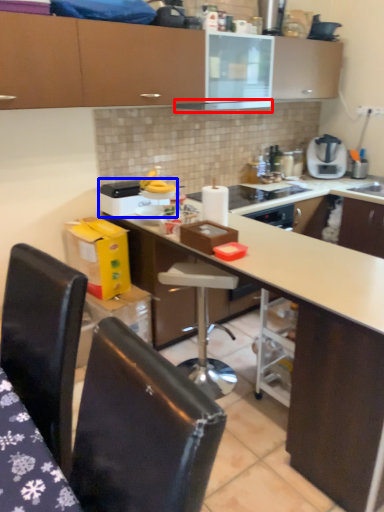
Question: Which object appears farthest to the camera in this image, exhaust hood (highlighted by a red box) or kitchen appliance (highlighted by a blue box)?

Choices:
 (A) exhaust hood
 (B) kitchen appliance

Answer: (A)